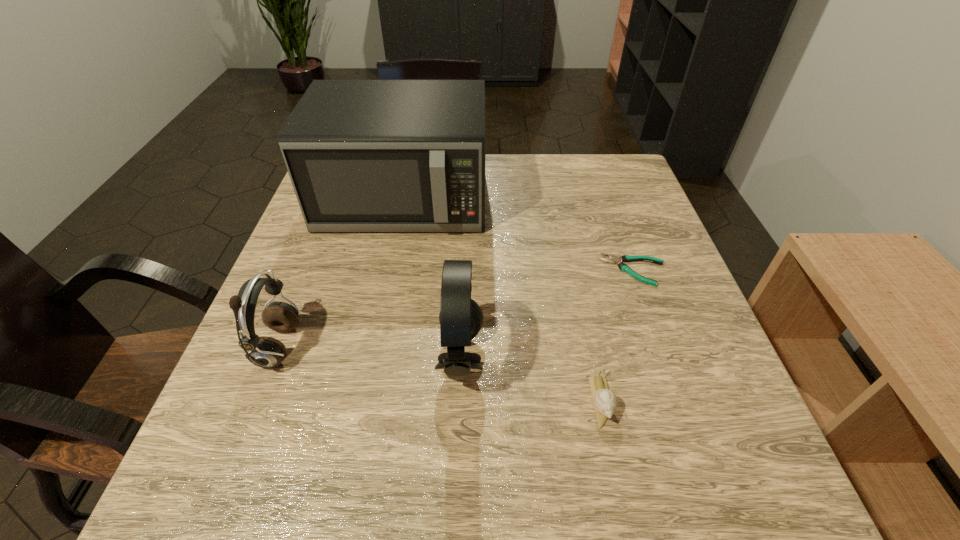
What are the coordinates of `free space at the near edge` in the screenshot? It's located at coord(588,471).

Image resolution: width=960 pixels, height=540 pixels. In the image, there is a desktop. What are the coordinates of `blank space at the left edge` in the screenshot? It's located at (215, 443).

Where is `vacant region at the right edge of the desktop`? vacant region at the right edge of the desktop is located at coordinates (704, 435).

Image resolution: width=960 pixels, height=540 pixels. Find the location of `free region at the near left corner of the desktop`. free region at the near left corner of the desktop is located at coordinates (224, 450).

Where is `vacant space at the far right corner of the desktop`? This screenshot has width=960, height=540. vacant space at the far right corner of the desktop is located at coordinates (631, 171).

Find the location of a particular element. empty location between the pliers and the microwave oven is located at coordinates (518, 234).

Locate an element on the screen. The height and width of the screenshot is (540, 960). vacant space that is in between the shorter earphone and the second object from right to left is located at coordinates (440, 374).

The image size is (960, 540). What are the coordinates of `empty space that is in between the fourth tallest object and the farthest object` in the screenshot? It's located at 502,299.

Image resolution: width=960 pixels, height=540 pixels. Find the location of `free space between the rightmost object and the farthest object`. free space between the rightmost object and the farthest object is located at coordinates (518, 234).

Identify the location of empty space that is in between the taller earphone and the rightmost object. (547, 314).